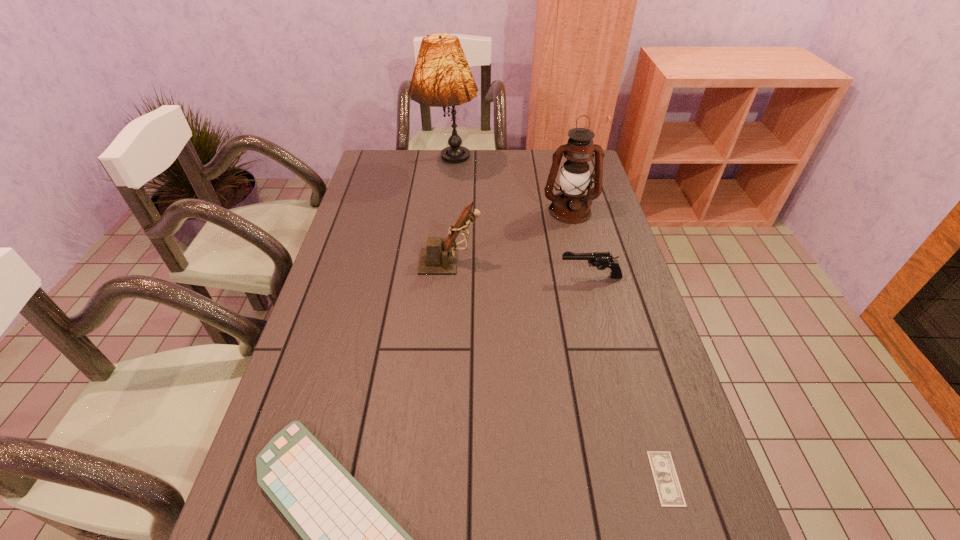
You are a GUI agent. You are given a task and a screenshot of the screen. Output one action in this format:
    pyautogui.click(x=<x>, y=<y>)
    Task: Click on the farthest object
    The width and height of the screenshot is (960, 540).
    Given the screenshot: What is the action you would take?
    pyautogui.click(x=442, y=77)

Find the location of a particular element. The image size is (960, 540). lampshade is located at coordinates (442, 77).

Locate an element on the screen. The width and height of the screenshot is (960, 540). the fifth shortest object is located at coordinates (571, 206).

Where is `the second farthest object`? the second farthest object is located at coordinates (571, 206).

Identify the location of figurine. The image size is (960, 540). (439, 258).

Where is `gun`? gun is located at coordinates (602, 260).

The height and width of the screenshot is (540, 960). Find the location of `money`. money is located at coordinates (670, 494).

The image size is (960, 540). What are the coordinates of `vacant space situated on the front-facing side of the farthest object` in the screenshot? It's located at (441, 239).

Where is `vacant space situated 0.180m on the side of the second farthest object, there is a wick adjustment knob`? The height and width of the screenshot is (540, 960). vacant space situated 0.180m on the side of the second farthest object, there is a wick adjustment knob is located at coordinates (583, 261).

Where is `vacant space located on the front-facing side of the fourth shortest object`? vacant space located on the front-facing side of the fourth shortest object is located at coordinates click(x=578, y=261).